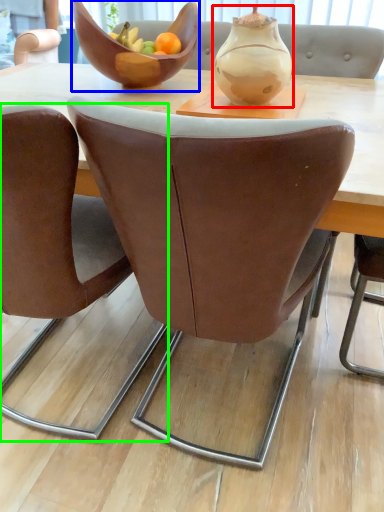
Question: Considering the real-world distances, which object is farthest from vase (highlighted by a red box)? bowl (highlighted by a blue box) or chair (highlighted by a green box)?

Choices:
 (A) bowl
 (B) chair

Answer: (B)